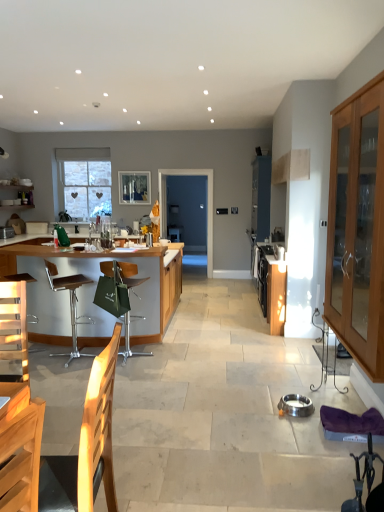
In order to click on free space in front of green fabric chair at center, which is the 1th chair from right to left in this screenshot , I will do `click(131, 374)`.